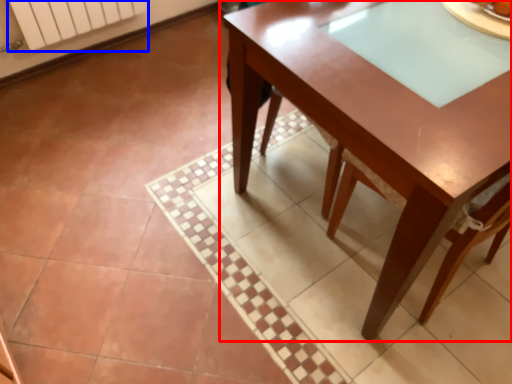
Question: Which object is further to the camera taking this photo, table (highlighted by a red box) or radiator (highlighted by a blue box)?

Choices:
 (A) table
 (B) radiator

Answer: (B)